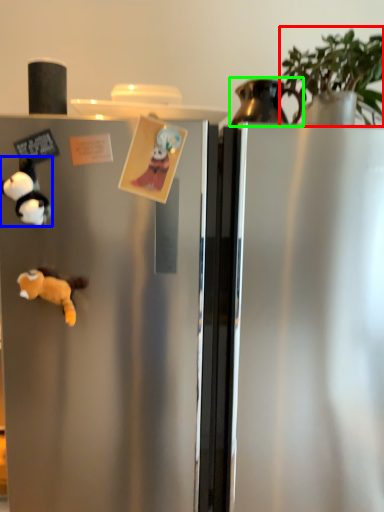
Question: Estimate the real-world distances between objects in this image. Which object is closer to plant (highlighted by a red box), toy (highlighted by a blue box) or appliance (highlighted by a green box)?

Choices:
 (A) toy
 (B) appliance

Answer: (B)